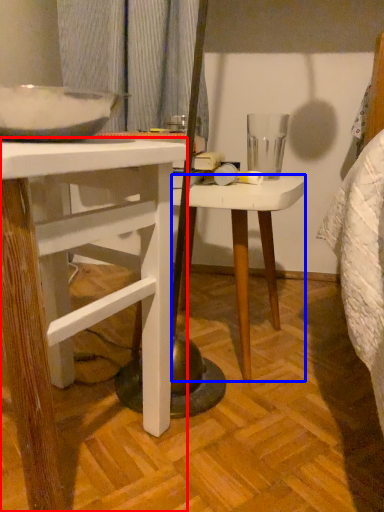
Question: Which point is further to the camera, desk (highlighted by a red box) or stool (highlighted by a blue box)?

Choices:
 (A) desk
 (B) stool

Answer: (B)